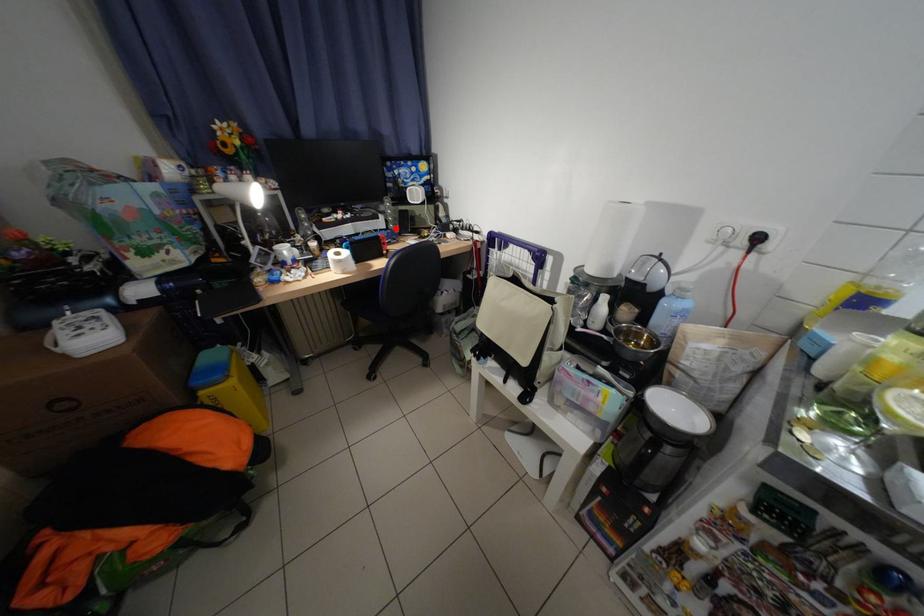
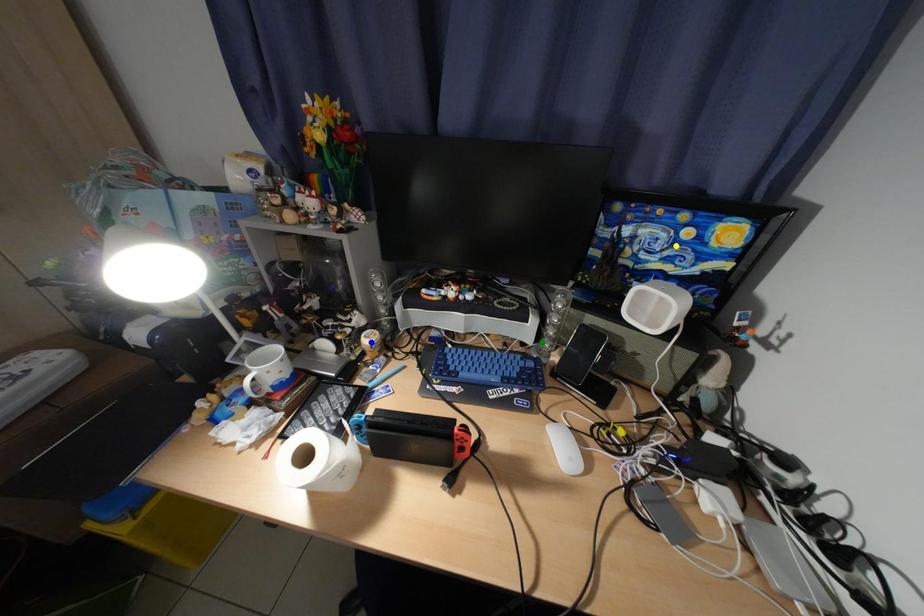
Question: I am providing you with two images of the same scene from different viewpoints. A red point is marked on the first image. You are given multiple points on the second image. Which point in image 2 is actually the same real-world point as the red point in image 1?

Choices:
 (A) blue point
 (B) green point
 (C) yellow point

Answer: (B)